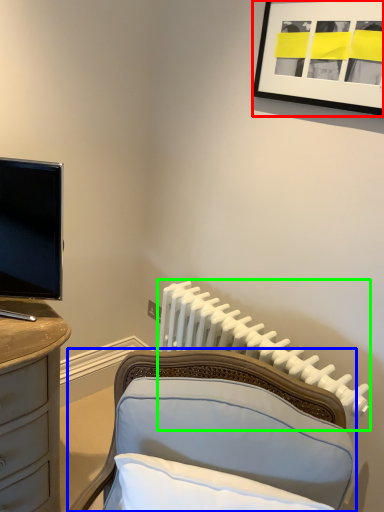
Question: Based on their relative distances, which object is farther from picture frame (highlighted by a red box)? Choose from furniture (highlighted by a blue box) and radiator (highlighted by a green box).

Choices:
 (A) furniture
 (B) radiator

Answer: (A)